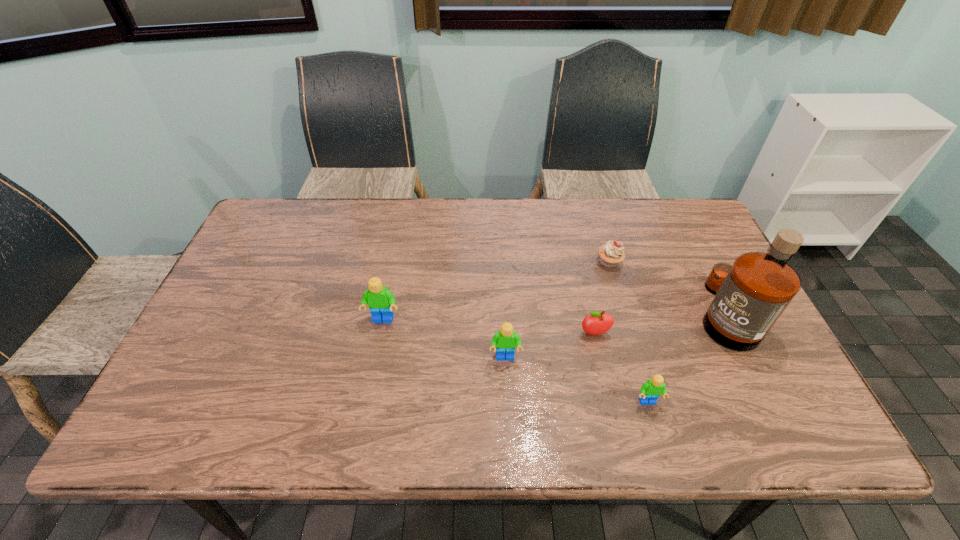
Image resolution: width=960 pixels, height=540 pixels. I want to click on the leftmost Lego, so click(380, 300).

Where is `the leftmost object`? This screenshot has height=540, width=960. the leftmost object is located at coordinates (380, 300).

Identify the location of the fifth object from right to left. The height and width of the screenshot is (540, 960). (505, 340).

Image resolution: width=960 pixels, height=540 pixels. I want to click on the third tallest object, so click(505, 340).

Where is `the nearest Lego`? the nearest Lego is located at coordinates (650, 391).

Find the location of a particular element. The height and width of the screenshot is (540, 960). the shortest Lego is located at coordinates (650, 391).

Where is `cupcake`? cupcake is located at coordinates (611, 254).

I want to click on the rightmost object, so click(751, 294).

In order to click on the tallest object in this screenshot , I will do `click(751, 294)`.

The height and width of the screenshot is (540, 960). Find the location of `the fourth object from right to left`. the fourth object from right to left is located at coordinates (595, 324).